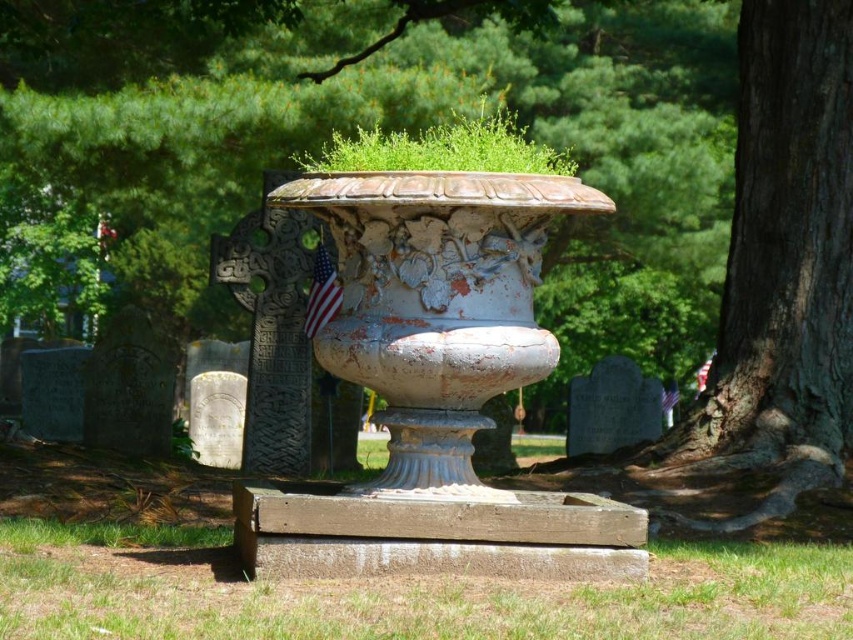
You are standing at the edge of the cemetery and want to place a new gravestone that is 1.5 meters wide between the green grass at lower center and the nearest gravestone. Is there enough space?

The distance between the green grass at lower center and the nearest gravestone is 5.59 meters. Since the gravestone is only 1.5 meters wide, there is sufficient space to place it between them.

You are standing in the cemetery scene described. You notice a point marked at coordinates (405, 595). Based on the scene description, what is located at this point?

The point at coordinates (405, 595) corresponds to green grass at lower center in the cemetery scene.